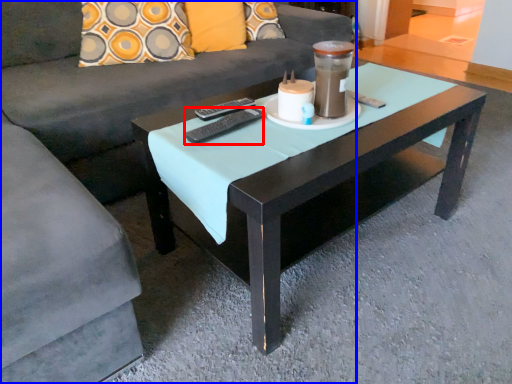
Question: Among these objects, which one is farthest to the camera, remote (highlighted by a red box) or studio couch (highlighted by a blue box)?

Choices:
 (A) remote
 (B) studio couch

Answer: (A)